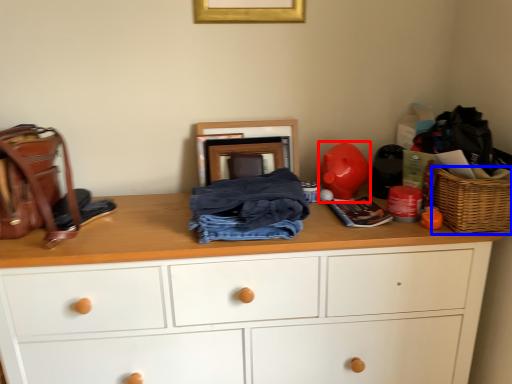
Question: Which of the following is the farthest to the observer, toy (highlighted by a red box) or picnic basket (highlighted by a blue box)?

Choices:
 (A) toy
 (B) picnic basket

Answer: (A)